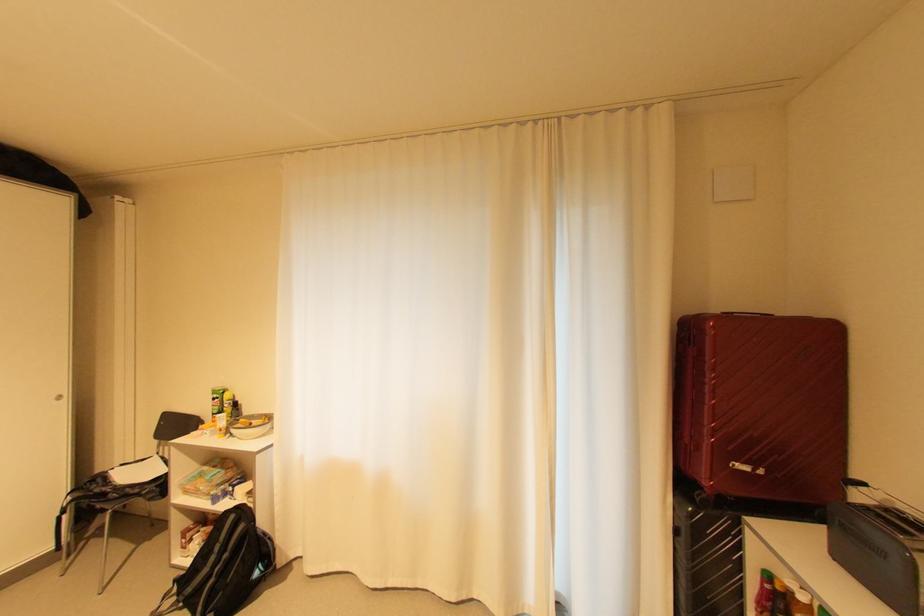
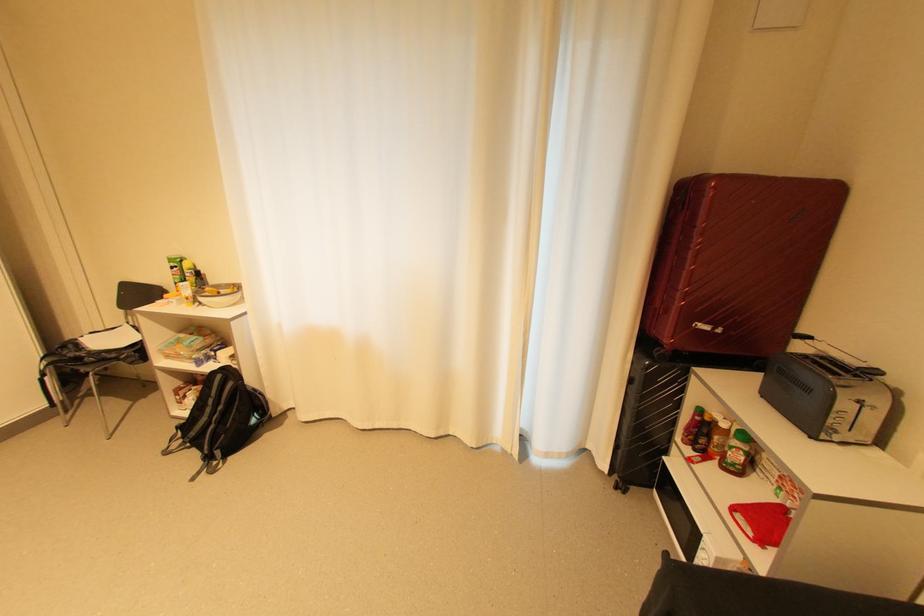
In the second image, find the point that corresponds to pixel 107 479 in the first image.

(79, 346)